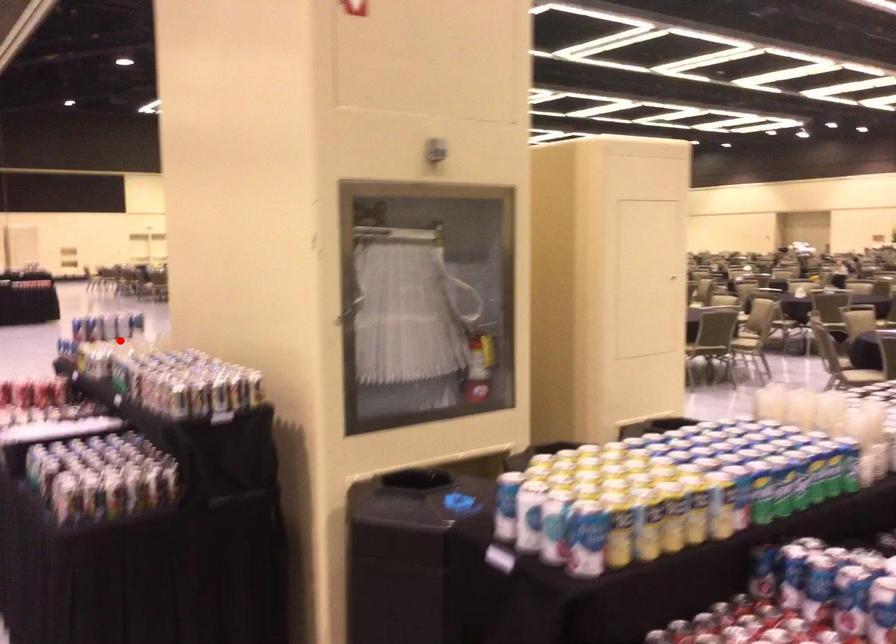
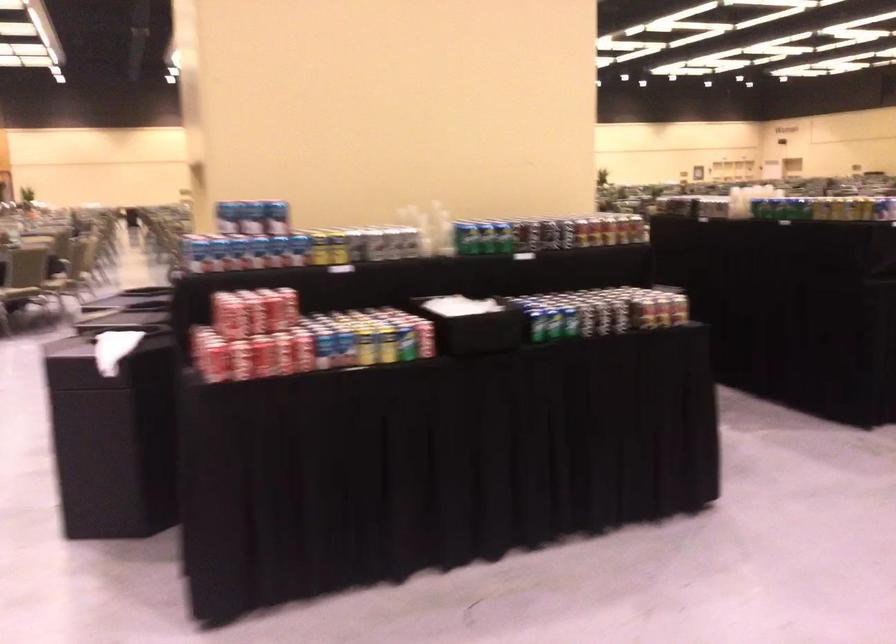
Question: I am providing you with two images of the same scene from different viewpoints. A red point is shown in image1. For the corresponding object point in image2, is it positioned nearer or farther from the camera?

Choices:
 (A) Nearer
 (B) Farther

Answer: (A)